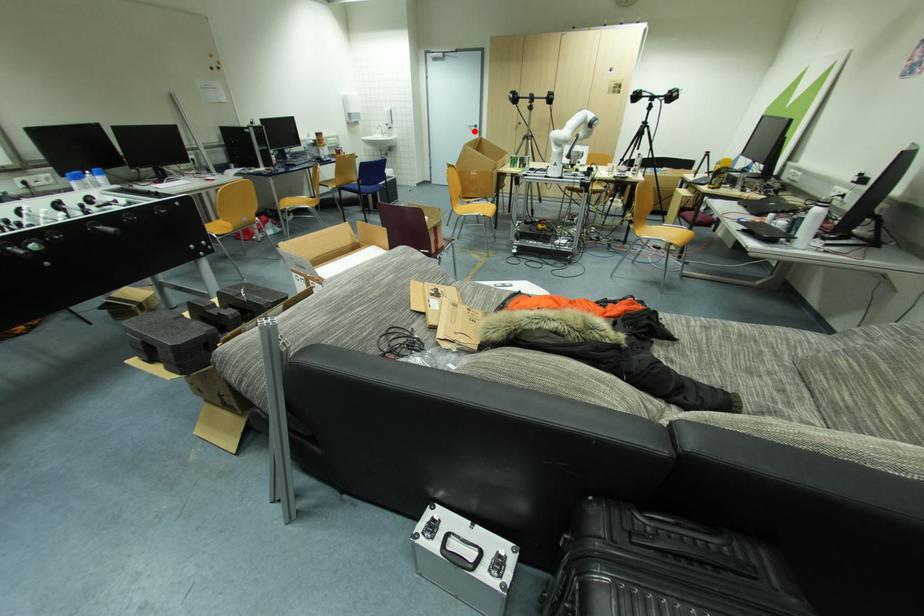
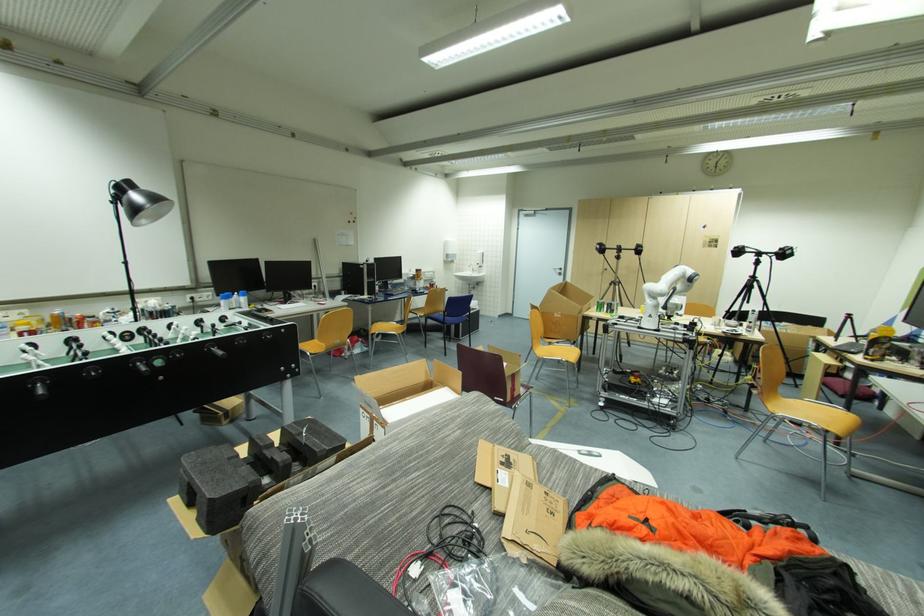
Locate, in the second image, the point that corresponds to the highlighted location in the first image.

(560, 273)